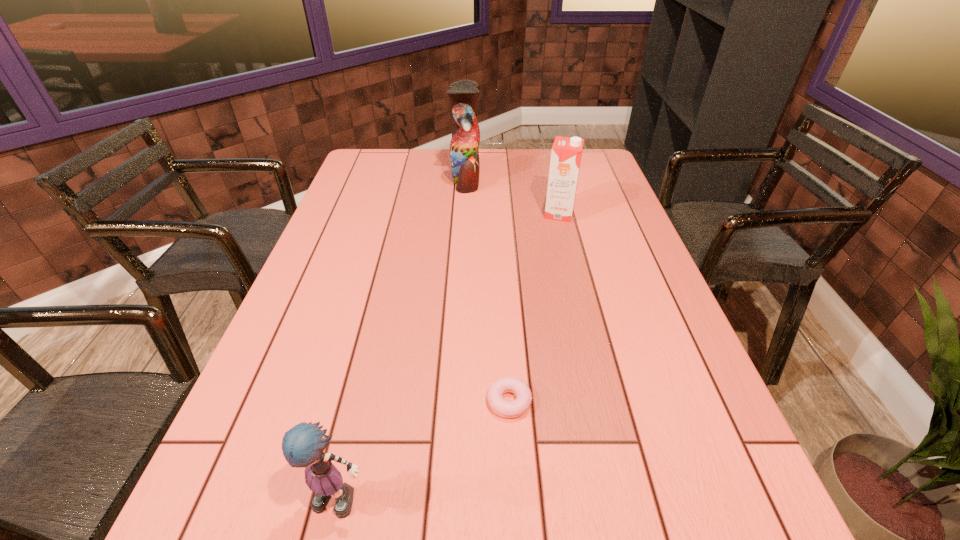
Locate an element on the screen. The width and height of the screenshot is (960, 540). vacant space that satisfies the following two spatial constraints: 1. at the face of the second farthest object; 2. on the right side of the farthest object is located at coordinates (464, 214).

Image resolution: width=960 pixels, height=540 pixels. What are the coordinates of `free location that satisfies the following two spatial constraints: 1. at the face of the parrot; 2. on the front-facing side of the leftmost object` in the screenshot? It's located at (449, 500).

Identify the location of vacant space that satisfies the following two spatial constraints: 1. at the face of the second object from left to right; 2. on the left side of the second farthest object. The image size is (960, 540). (464, 214).

At what (x,y) coordinates should I click in order to perform the action: click on blank area in the image that satisfies the following two spatial constraints: 1. at the face of the rightmost object; 2. on the right side of the parrot. Please return your answer as a coordinate pair (x, y). The width and height of the screenshot is (960, 540). Looking at the image, I should click on (464, 214).

Find the location of `vacant space that satisfies the following two spatial constraints: 1. at the face of the parrot; 2. on the left side of the second object from right to left`. vacant space that satisfies the following two spatial constraints: 1. at the face of the parrot; 2. on the left side of the second object from right to left is located at coordinates (454, 401).

This screenshot has height=540, width=960. In order to click on vacant position in the image that satisfies the following two spatial constraints: 1. at the face of the second object from right to left; 2. on the right side of the farthest object in this screenshot , I will do `click(454, 401)`.